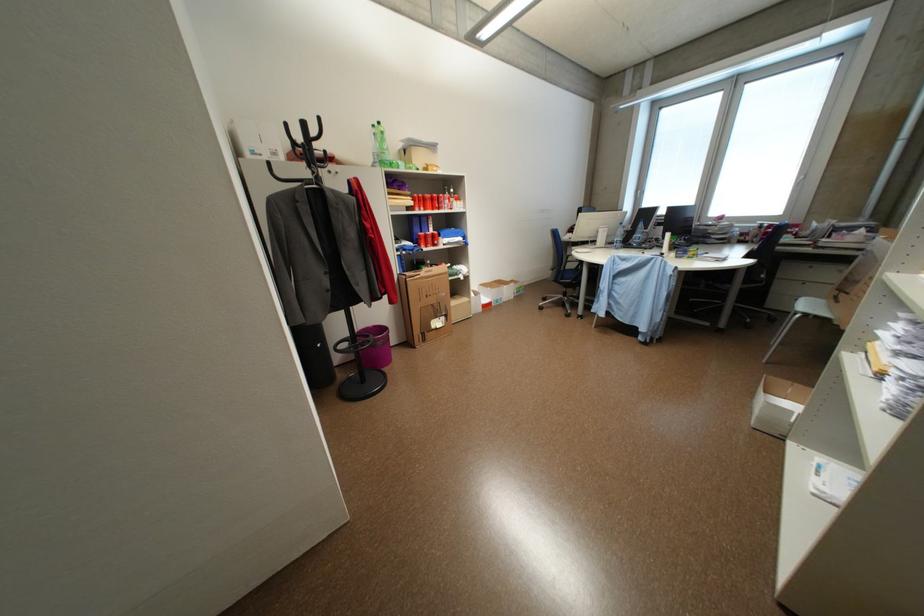
In order to click on black coat stand hook in this screenshot , I will do `click(289, 136)`.